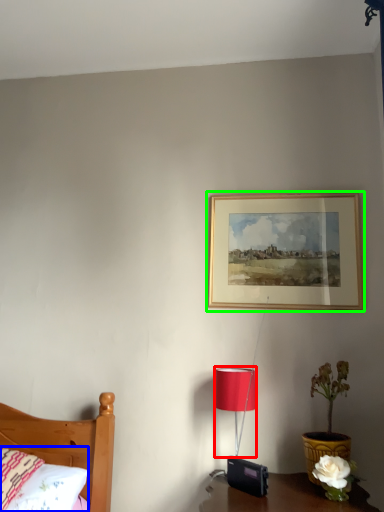
Question: Which object is the farthest from lamp (highlighted by a red box)? Choose among these: pillow (highlighted by a blue box) or picture frame (highlighted by a green box).

Choices:
 (A) pillow
 (B) picture frame

Answer: (A)